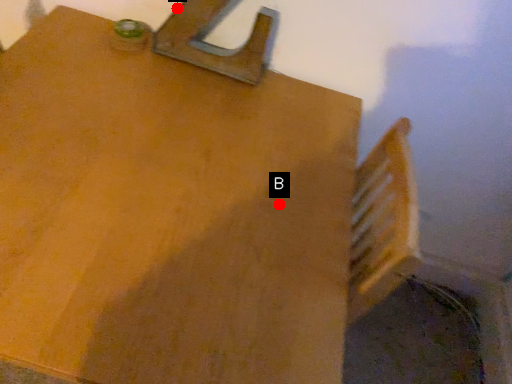
Question: Two points are circled on the image, labeled by A and B beside each circle. Among these points, which one is nearest to the camera?

Choices:
 (A) A is closer
 (B) B is closer

Answer: (B)